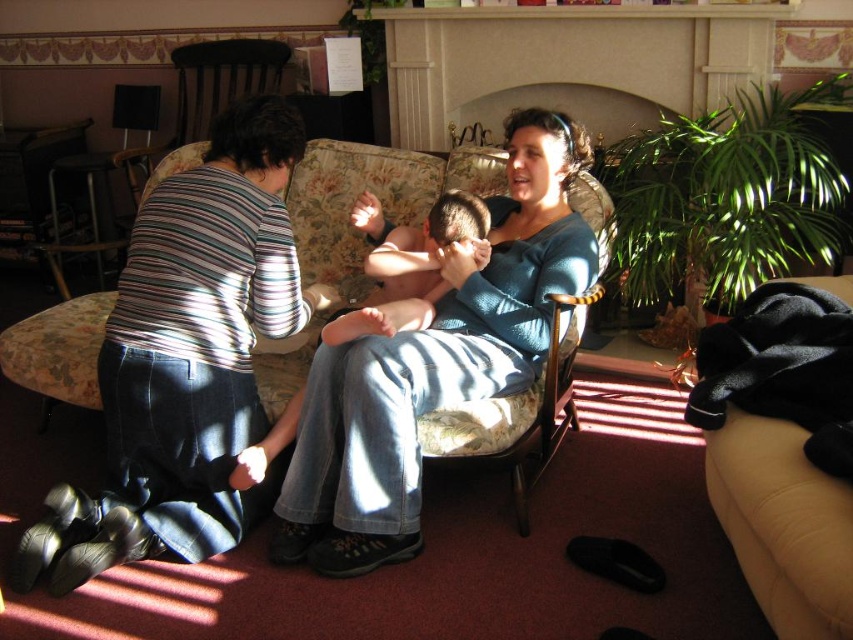
Question: Among these objects, which one is nearest to the camera?

Choices:
 (A) blue denim jeans at center
 (B) beige fabric couch at lower right
 (C) dark blue jeans at lower left

Answer: (B)

Question: Is dark blue jeans at lower left bigger than smooth skin baby at center?

Choices:
 (A) yes
 (B) no

Answer: (A)

Question: Is dark blue jeans at lower left closer to camera compared to beige fabric couch at lower right?

Choices:
 (A) yes
 (B) no

Answer: (B)

Question: Which object is positioned farthest from the dark blue jeans at lower left?

Choices:
 (A) beige fabric couch at lower right
 (B) blue denim jeans at center
 (C) smooth skin baby at center

Answer: (A)

Question: Does beige fabric couch at lower right appear under smooth skin baby at center?

Choices:
 (A) no
 (B) yes

Answer: (B)

Question: Which object is farther from the camera taking this photo?

Choices:
 (A) dark blue jeans at lower left
 (B) beige fabric couch at lower right
 (C) blue denim jeans at center

Answer: (A)